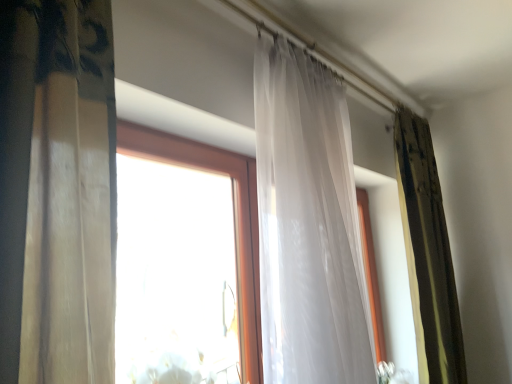
Question: Is there a large distance between translucent white curtain at center, marked as the 2th curtain in a back-to-front arrangement, and green textured curtain at right, the 2th curtain viewed from the left?

Choices:
 (A) no
 (B) yes

Answer: (A)

Question: From the image's perspective, is translucent white curtain at center, which is counted as the 2th curtain, starting from the right, above green textured curtain at right, the 2th curtain viewed from the left?

Choices:
 (A) no
 (B) yes

Answer: (B)

Question: Is translucent white curtain at center, positioned as the first curtain in front-to-back order, positioned with its back to green textured curtain at right, the 2th curtain viewed from the left?

Choices:
 (A) yes
 (B) no

Answer: (B)

Question: Considering the relative sizes of translucent white curtain at center, marked as the 2th curtain in a back-to-front arrangement, and green textured curtain at right, arranged as the first curtain when viewed from the right, in the image provided, is translucent white curtain at center, marked as the 2th curtain in a back-to-front arrangement, bigger than green textured curtain at right, arranged as the first curtain when viewed from the right,?

Choices:
 (A) yes
 (B) no

Answer: (A)

Question: Could you tell me if translucent white curtain at center, which is counted as the 2th curtain, starting from the right, is turned towards green textured curtain at right, the 2th curtain viewed from the left?

Choices:
 (A) no
 (B) yes

Answer: (A)

Question: Does translucent white curtain at center, arranged as the first curtain when viewed from the left, have a smaller size compared to green textured curtain at right, the 2th curtain viewed from the left?

Choices:
 (A) yes
 (B) no

Answer: (B)

Question: Is green textured curtain at right, acting as the 2th curtain starting from the front, positioned beyond the bounds of translucent white curtain at center, positioned as the first curtain in front-to-back order?

Choices:
 (A) no
 (B) yes

Answer: (B)

Question: Considering the relative sizes of green textured curtain at right, acting as the 2th curtain starting from the front, and translucent white curtain at center, which is counted as the 2th curtain, starting from the right, in the image provided, is green textured curtain at right, acting as the 2th curtain starting from the front, taller than translucent white curtain at center, which is counted as the 2th curtain, starting from the right,?

Choices:
 (A) no
 (B) yes

Answer: (B)

Question: Considering the relative positions of green textured curtain at right, arranged as the first curtain when viewed from the right, and translucent white curtain at center, arranged as the first curtain when viewed from the left, in the image provided, is green textured curtain at right, arranged as the first curtain when viewed from the right, to the right of translucent white curtain at center, arranged as the first curtain when viewed from the left, from the viewer's perspective?

Choices:
 (A) no
 (B) yes

Answer: (B)

Question: Does green textured curtain at right, arranged as the first curtain when viewed from the right, have a greater width compared to translucent white curtain at center, which is counted as the 2th curtain, starting from the right?

Choices:
 (A) yes
 (B) no

Answer: (B)

Question: Is green textured curtain at right, the 2th curtain viewed from the left, looking in the opposite direction of translucent white curtain at center, marked as the 2th curtain in a back-to-front arrangement?

Choices:
 (A) yes
 (B) no

Answer: (B)

Question: Is green textured curtain at right, the 2th curtain viewed from the left, shorter than translucent white curtain at center, arranged as the first curtain when viewed from the left?

Choices:
 (A) yes
 (B) no

Answer: (B)

Question: Choose the correct answer: Is green textured curtain at right, the 2th curtain viewed from the left, inside translucent white curtain at center, arranged as the first curtain when viewed from the left, or outside it?

Choices:
 (A) inside
 (B) outside

Answer: (B)